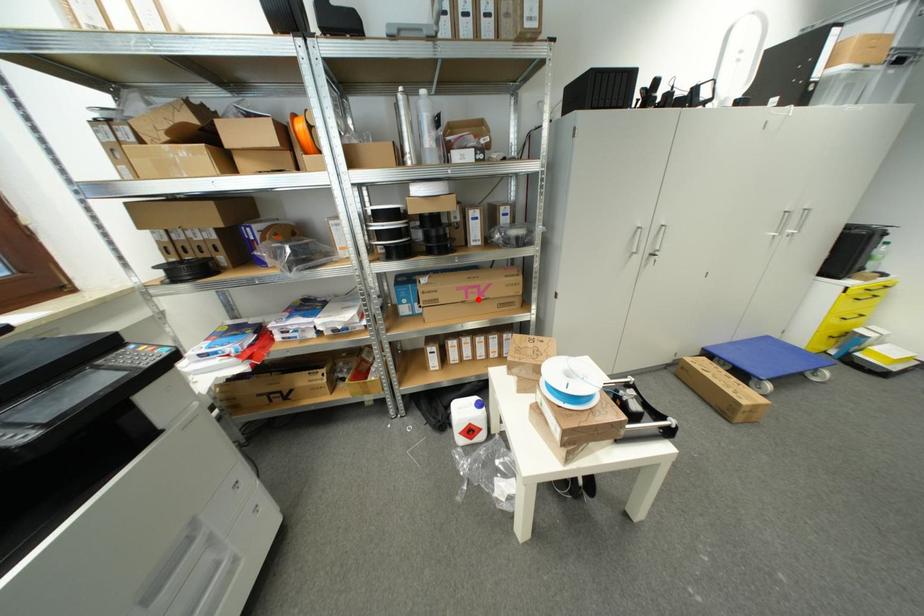
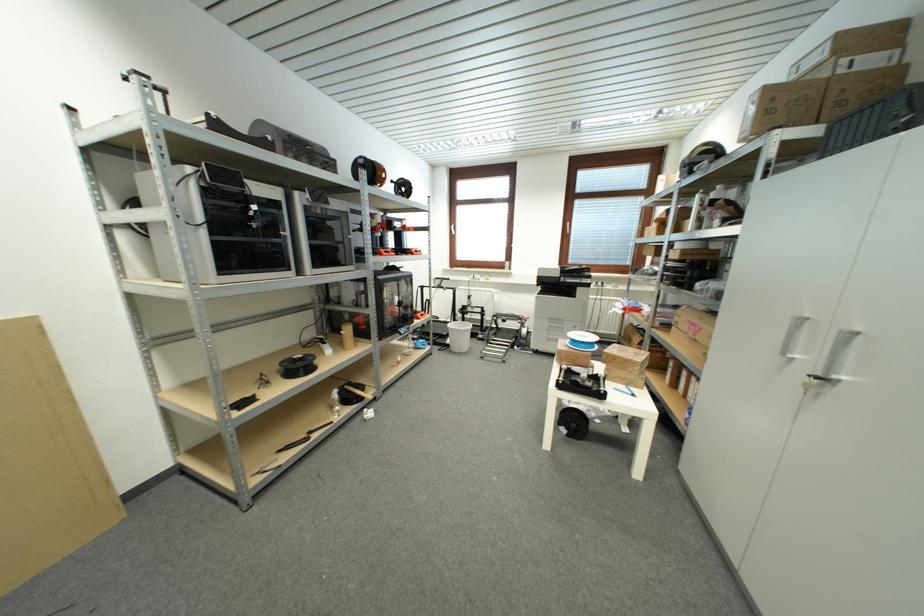
Question: I am providing you with two images of the same scene from different viewpoints. A red point is shown in image1. For the corresponding object point in image2, is it positioned nearer or farther from the camera?

Choices:
 (A) Nearer
 (B) Farther

Answer: (A)